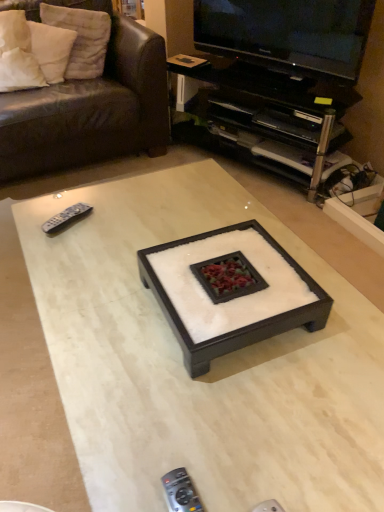
Locate an element on the screen. The height and width of the screenshot is (512, 384). free space to the left of gray plastic remote at left, the first remote control viewed from the left is located at coordinates (28, 222).